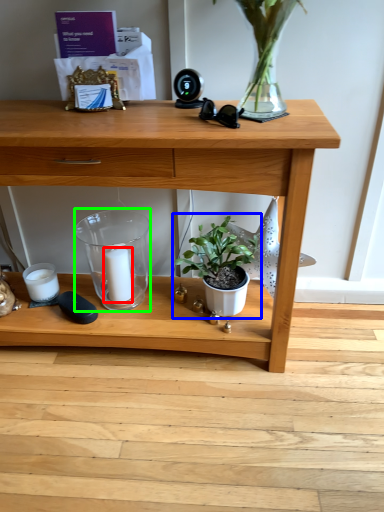
Question: Based on their relative distances, which object is farther from candle (highlighted by a red box)? Choose from houseplant (highlighted by a blue box) and glass vase (highlighted by a green box).

Choices:
 (A) houseplant
 (B) glass vase

Answer: (A)